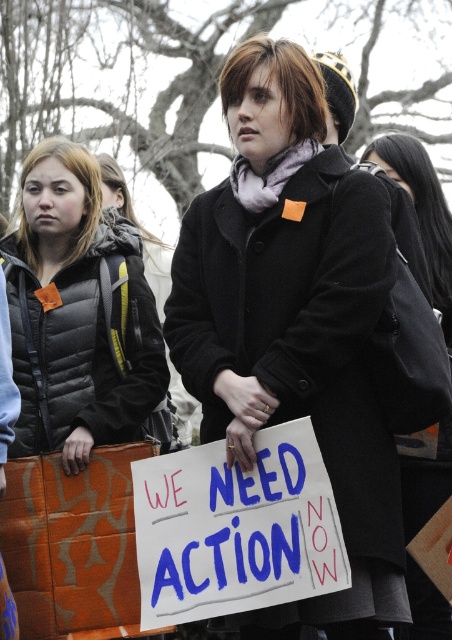
Question: From the image, what is the correct spatial relationship of matte black coat at center in relation to black wool coat at center?

Choices:
 (A) right
 (B) left

Answer: (B)

Question: Among these objects, which one is nearest to the camera?

Choices:
 (A) black quilted jacket at left
 (B) matte black coat at center

Answer: (B)

Question: Does matte black coat at center have a lesser width compared to black wool coat at center?

Choices:
 (A) yes
 (B) no

Answer: (A)

Question: Which object is the farthest from the matte black coat at center?

Choices:
 (A) black puffer jacket at left
 (B) black quilted jacket at left
 (C) black wool coat at center

Answer: (B)

Question: Which object is closer to the camera taking this photo?

Choices:
 (A) black wool coat at center
 (B) black quilted jacket at left
 (C) matte black coat at center

Answer: (C)

Question: Does black wool coat at center lie in front of black quilted jacket at left?

Choices:
 (A) no
 (B) yes

Answer: (B)